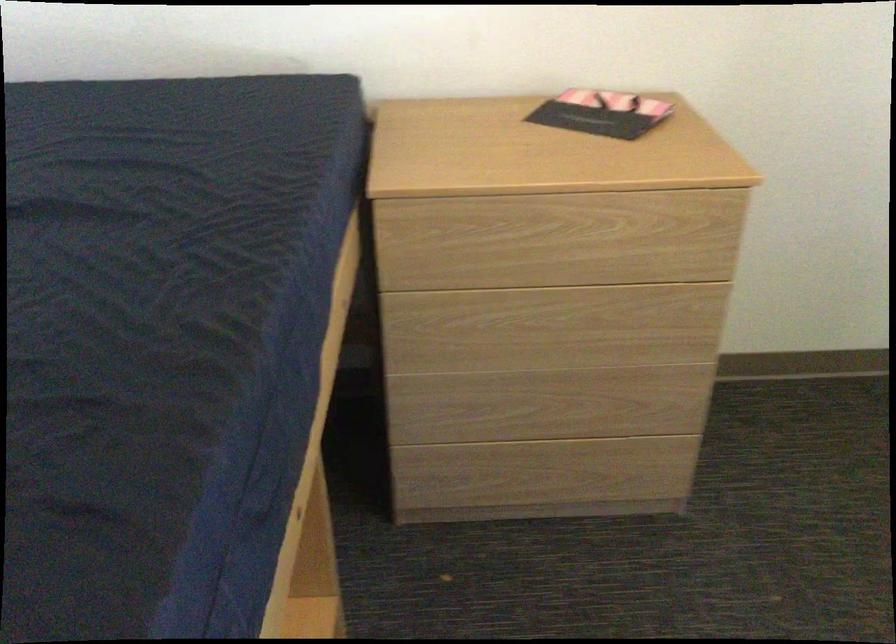
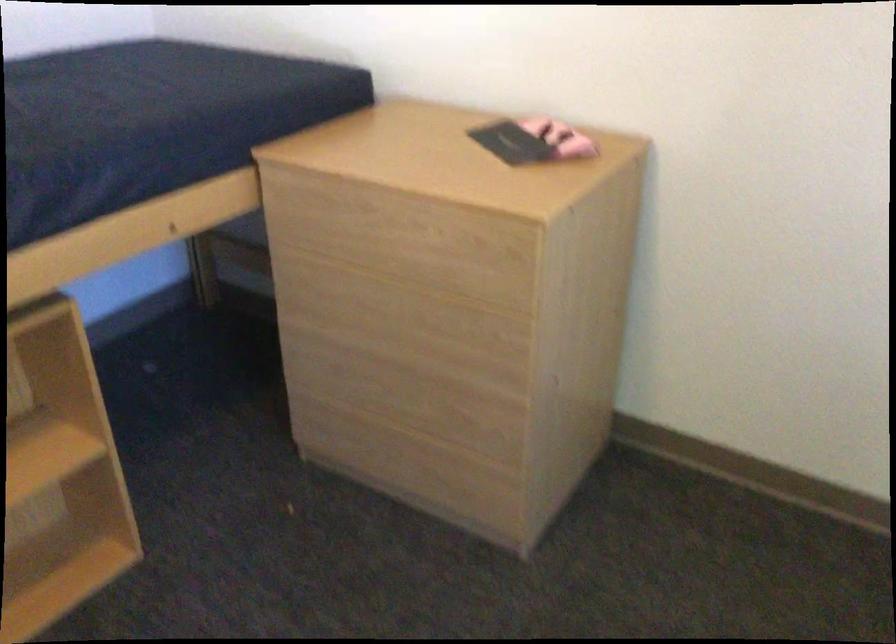
Locate, in the second image, the point that corresponds to point (475, 232) in the first image.

(324, 209)